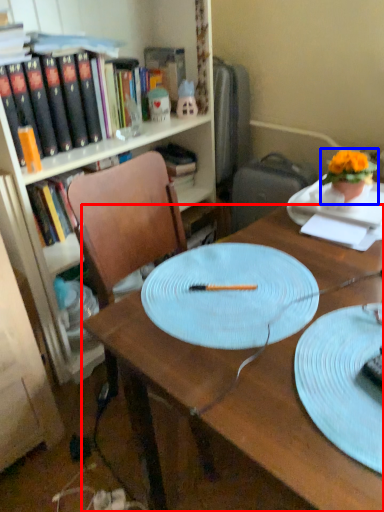
Question: Which object is further to the camera taking this photo, desk (highlighted by a red box) or houseplant (highlighted by a blue box)?

Choices:
 (A) desk
 (B) houseplant

Answer: (B)